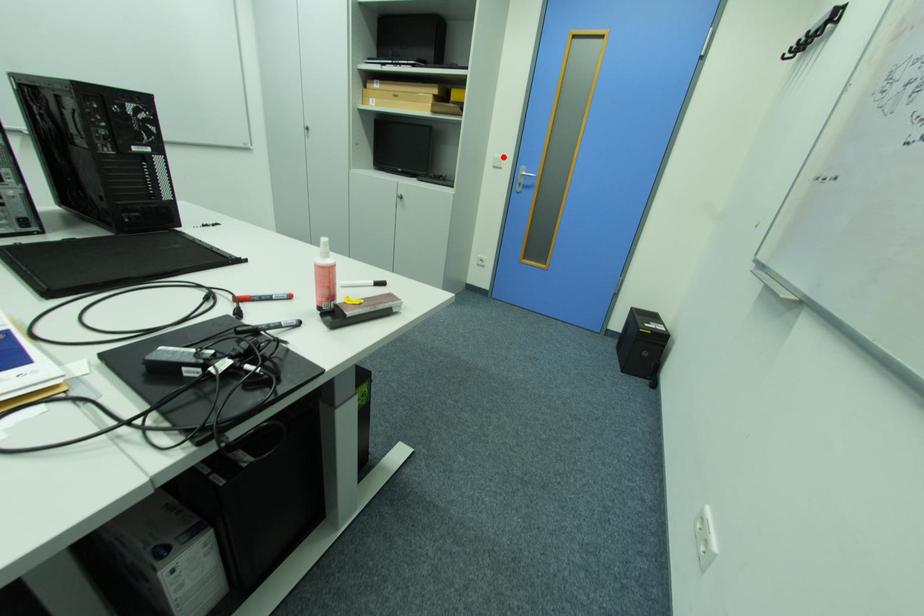
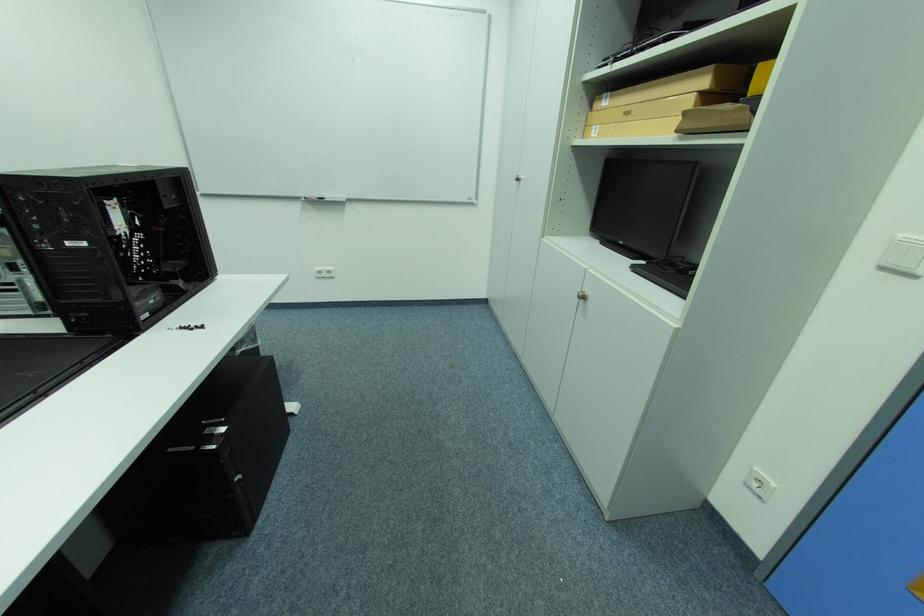
Find the pixel in the second image that matches the highlighted location in the first image.

(907, 236)